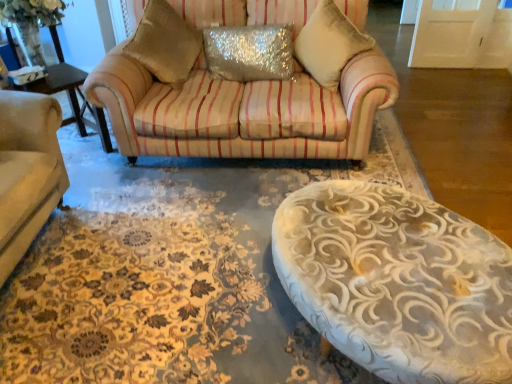
Image resolution: width=512 pixels, height=384 pixels. Find the location of `sparkly silver pillow at center, which appears as the 2th pillow when viewed from the right`. sparkly silver pillow at center, which appears as the 2th pillow when viewed from the right is located at coordinates (249, 52).

Describe the element at coordinates (249, 52) in the screenshot. This screenshot has width=512, height=384. I see `sparkly silver pillow at center, which is the first pillow in left-to-right order` at that location.

What is the approximate height of sparkly silver pillow at center, which appears as the 2th pillow when viewed from the right?

sparkly silver pillow at center, which appears as the 2th pillow when viewed from the right, is 12.76 inches tall.

At what (x,y) coordinates should I click in order to perform the action: click on velvet beige pillow at upper center, the 1th pillow when ordered from right to left. Please return your answer as a coordinate pair (x, y). Looking at the image, I should click on (329, 44).

The width and height of the screenshot is (512, 384). What do you see at coordinates (329, 44) in the screenshot?
I see `velvet beige pillow at upper center, the second pillow positioned from the left` at bounding box center [329, 44].

Measure the distance between point [301,51] and camera.

A distance of 2.51 meters exists between point [301,51] and camera.

Locate an element on the screen. sparkly silver pillow at center, which is the first pillow in left-to-right order is located at coordinates (249, 52).

Between sparkly silver pillow at center, which is the first pillow in left-to-right order, and velvet beige pillow at upper center, the 1th pillow when ordered from right to left, which one appears on the left side from the viewer's perspective?

sparkly silver pillow at center, which is the first pillow in left-to-right order, is more to the left.

Relative to velvet beige pillow at upper center, the second pillow positioned from the left, is sparkly silver pillow at center, which appears as the 2th pillow when viewed from the right, in front or behind?

In the image, sparkly silver pillow at center, which appears as the 2th pillow when viewed from the right, appears behind velvet beige pillow at upper center, the second pillow positioned from the left.

Which is in front, point (262, 63) or point (343, 36)?

Point (343, 36)

From the image's perspective, is sparkly silver pillow at center, which appears as the 2th pillow when viewed from the right, located above or below velvet beige pillow at upper center, the second pillow positioned from the left?

sparkly silver pillow at center, which appears as the 2th pillow when viewed from the right, is below velvet beige pillow at upper center, the second pillow positioned from the left.

From a real-world perspective, which object stands above the other?

From a 3D spatial view, velvet beige pillow at upper center, the 1th pillow when ordered from right to left, is above.

Considering the sizes of objects sparkly silver pillow at center, which is the first pillow in left-to-right order, and velvet beige pillow at upper center, the 1th pillow when ordered from right to left, in the image provided, who is wider, sparkly silver pillow at center, which is the first pillow in left-to-right order, or velvet beige pillow at upper center, the 1th pillow when ordered from right to left,?

With larger width is velvet beige pillow at upper center, the 1th pillow when ordered from right to left.

From the picture: Is sparkly silver pillow at center, which is the first pillow in left-to-right order, taller or shorter than velvet beige pillow at upper center, the second pillow positioned from the left?

In the image, sparkly silver pillow at center, which is the first pillow in left-to-right order, appears to be shorter than velvet beige pillow at upper center, the second pillow positioned from the left.

Considering the relative sizes of sparkly silver pillow at center, which is the first pillow in left-to-right order, and velvet beige pillow at upper center, the second pillow positioned from the left, in the image provided, is sparkly silver pillow at center, which is the first pillow in left-to-right order, smaller than velvet beige pillow at upper center, the second pillow positioned from the left,?

Indeed, sparkly silver pillow at center, which is the first pillow in left-to-right order, has a smaller size compared to velvet beige pillow at upper center, the second pillow positioned from the left.

Is sparkly silver pillow at center, which appears as the 2th pillow when viewed from the right, inside the boundaries of velvet beige pillow at upper center, the second pillow positioned from the left, or outside?

sparkly silver pillow at center, which appears as the 2th pillow when viewed from the right, is spatially situated outside velvet beige pillow at upper center, the second pillow positioned from the left.

Is there a large distance between sparkly silver pillow at center, which appears as the 2th pillow when viewed from the right, and velvet beige pillow at upper center, the 1th pillow when ordered from right to left?

No.

Is sparkly silver pillow at center, which is the first pillow in left-to-right order, oriented away from velvet beige pillow at upper center, the 1th pillow when ordered from right to left?

That's not correct — sparkly silver pillow at center, which is the first pillow in left-to-right order, is not looking away from velvet beige pillow at upper center, the 1th pillow when ordered from right to left.

Can you tell me how much sparkly silver pillow at center, which is the first pillow in left-to-right order, and velvet beige pillow at upper center, the second pillow positioned from the left, differ in facing direction?

23.3 degrees.

Identify the location of pillow located below the velvet beige pillow at upper center, the 1th pillow when ordered from right to left (from the image's perspective). (249, 52).

Is velvet beige pillow at upper center, the 1th pillow when ordered from right to left, to the left of sparkly silver pillow at center, which is the first pillow in left-to-right order, from the viewer's perspective?

No.

Consider the image. Which object is more forward, velvet beige pillow at upper center, the second pillow positioned from the left, or sparkly silver pillow at center, which is the first pillow in left-to-right order?

Positioned in front is velvet beige pillow at upper center, the second pillow positioned from the left.

Between point (341, 14) and point (266, 79), which one is positioned in front?

The point (341, 14) is in front.

From the image's perspective, is velvet beige pillow at upper center, the second pillow positioned from the left, beneath sparkly silver pillow at center, which is the first pillow in left-to-right order?

Actually, velvet beige pillow at upper center, the second pillow positioned from the left, appears above sparkly silver pillow at center, which is the first pillow in left-to-right order, in the image.

From a real-world perspective, is velvet beige pillow at upper center, the second pillow positioned from the left, physically located above or below sparkly silver pillow at center, which appears as the 2th pillow when viewed from the right?

Clearly, from a real-world perspective, velvet beige pillow at upper center, the second pillow positioned from the left, is above sparkly silver pillow at center, which appears as the 2th pillow when viewed from the right.

Does velvet beige pillow at upper center, the 1th pillow when ordered from right to left, have a lesser width compared to sparkly silver pillow at center, which is the first pillow in left-to-right order?

In fact, velvet beige pillow at upper center, the 1th pillow when ordered from right to left, might be wider than sparkly silver pillow at center, which is the first pillow in left-to-right order.

Considering the sizes of objects velvet beige pillow at upper center, the second pillow positioned from the left, and sparkly silver pillow at center, which appears as the 2th pillow when viewed from the right, in the image provided, who is taller, velvet beige pillow at upper center, the second pillow positioned from the left, or sparkly silver pillow at center, which appears as the 2th pillow when viewed from the right,?

With more height is velvet beige pillow at upper center, the second pillow positioned from the left.

From the picture: Considering the sizes of objects velvet beige pillow at upper center, the 1th pillow when ordered from right to left, and sparkly silver pillow at center, which appears as the 2th pillow when viewed from the right, in the image provided, who is smaller, velvet beige pillow at upper center, the 1th pillow when ordered from right to left, or sparkly silver pillow at center, which appears as the 2th pillow when viewed from the right,?

Smaller between the two is sparkly silver pillow at center, which appears as the 2th pillow when viewed from the right.

Would you say velvet beige pillow at upper center, the 1th pillow when ordered from right to left, is outside sparkly silver pillow at center, which is the first pillow in left-to-right order?

Indeed, velvet beige pillow at upper center, the 1th pillow when ordered from right to left, is completely outside sparkly silver pillow at center, which is the first pillow in left-to-right order.

Is velvet beige pillow at upper center, the 1th pillow when ordered from right to left, touching sparkly silver pillow at center, which appears as the 2th pillow when viewed from the right?

velvet beige pillow at upper center, the 1th pillow when ordered from right to left, and sparkly silver pillow at center, which appears as the 2th pillow when viewed from the right, are not in contact.

Is velvet beige pillow at upper center, the second pillow positioned from the left, facing away from sparkly silver pillow at center, which is the first pillow in left-to-right order?

No, velvet beige pillow at upper center, the second pillow positioned from the left,'s orientation is not away from sparkly silver pillow at center, which is the first pillow in left-to-right order.

Can you tell me how much velvet beige pillow at upper center, the second pillow positioned from the left, and sparkly silver pillow at center, which is the first pillow in left-to-right order, differ in facing direction?

There is a 23.3-degree angle between the facing directions of velvet beige pillow at upper center, the second pillow positioned from the left, and sparkly silver pillow at center, which is the first pillow in left-to-right order.

I want to click on pillow below the velvet beige pillow at upper center, the 1th pillow when ordered from right to left (from the image's perspective), so click(x=249, y=52).

What are the coordinates of `pillow behind the velvet beige pillow at upper center, the 1th pillow when ordered from right to left` in the screenshot? It's located at (249, 52).

At what (x,y) coordinates should I click in order to perform the action: click on pillow above the sparkly silver pillow at center, which is the first pillow in left-to-right order (from a real-world perspective). Please return your answer as a coordinate pair (x, y). This screenshot has width=512, height=384. Looking at the image, I should click on (329, 44).